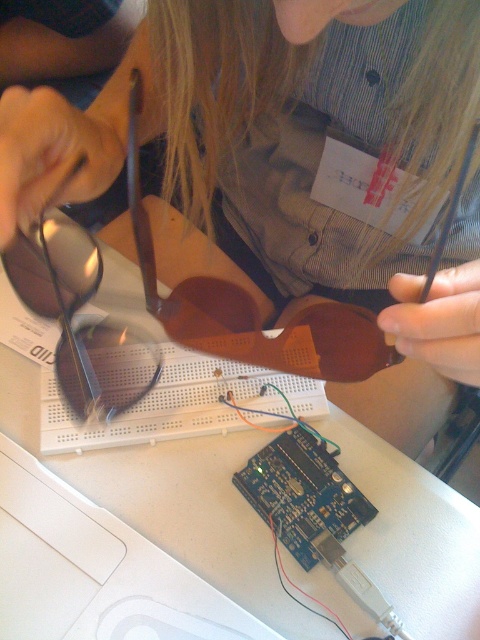
Does matte brown sunglasses at center have a greater width compared to matte brown goggles at upper left?

Indeed, matte brown sunglasses at center has a greater width compared to matte brown goggles at upper left.

Is point (405, 138) positioned after point (14, 284)?

That is False.

You are a GUI agent. You are given a task and a screenshot of the screen. Output one action in this format:
    pyautogui.click(x=<x>, y=<y>)
    Task: Click on the matte brown sunglasses at center
    Image resolution: width=480 pixels, height=640 pixels.
    Given the screenshot: What is the action you would take?
    (x=289, y=164)